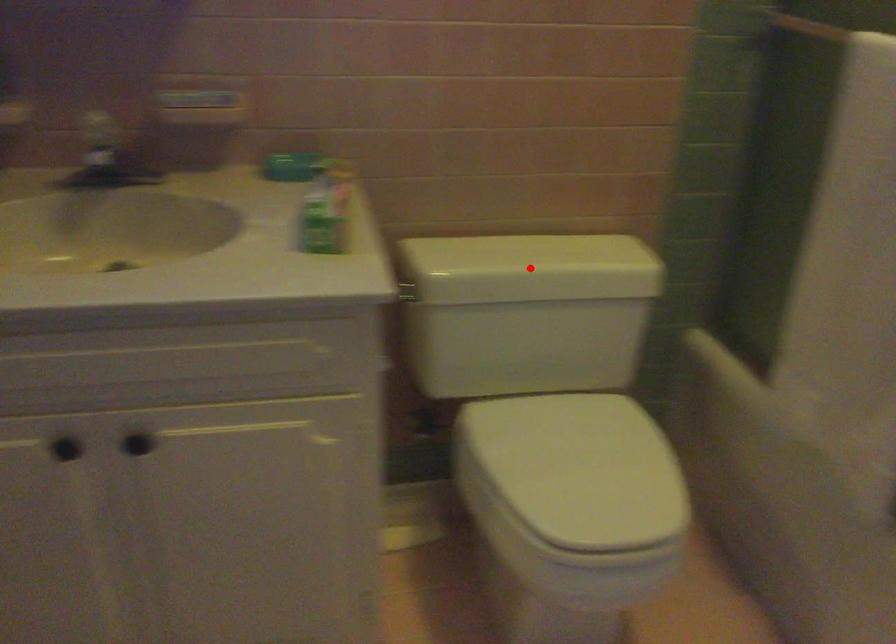
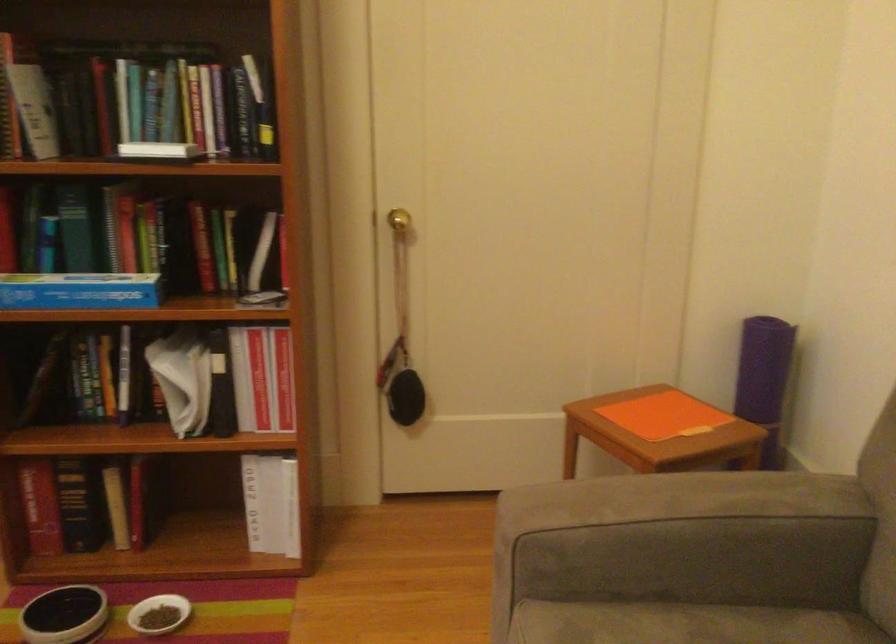
Question: I am providing you with two images of the same scene from different viewpoints. A red point is marked on the first image. Can you still see the location of the red point in image 2?

Choices:
 (A) Yes
 (B) No

Answer: (B)